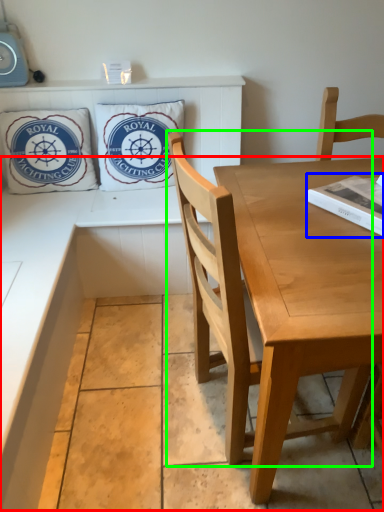
Question: Which is farther away from counter (highlighted by a red box)? magazine (highlighted by a blue box) or chair (highlighted by a green box)?

Choices:
 (A) magazine
 (B) chair

Answer: (A)